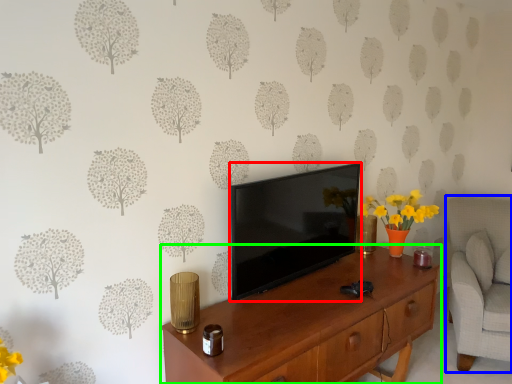
Question: Considering the real-world distances, which object is farthest from television (highlighted by a red box)? swivel chair (highlighted by a blue box) or desk (highlighted by a green box)?

Choices:
 (A) swivel chair
 (B) desk

Answer: (A)